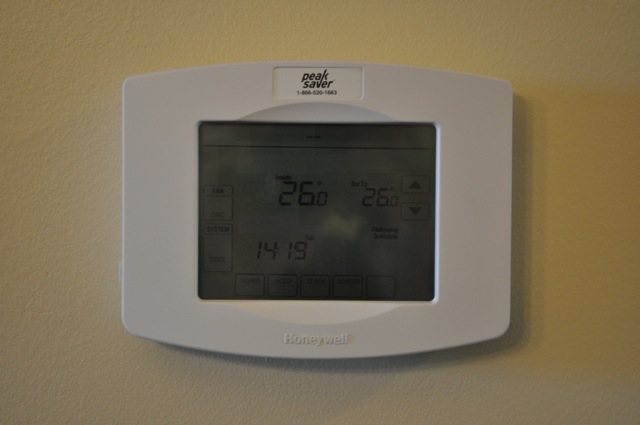
Locate an element on the screen. This screenshot has width=640, height=425. yellow wall is located at coordinates (456, 33).